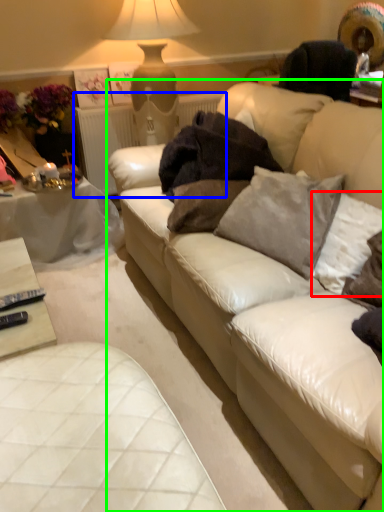
Question: Which object is positioned closest to pillow (highlighted by a red box)? Select from radiator (highlighted by a blue box) and studio couch (highlighted by a green box).

Choices:
 (A) radiator
 (B) studio couch

Answer: (B)